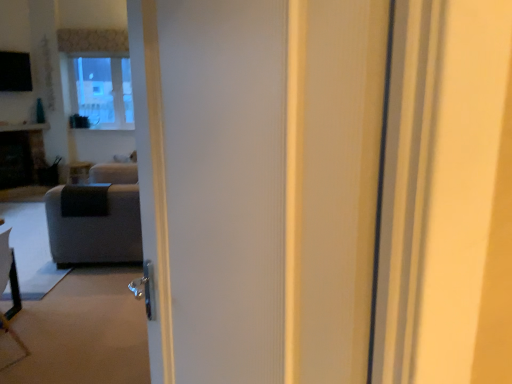
Question: From the image's perspective, is matte black side table at center beneath dark gray stone fireplace at left?

Choices:
 (A) no
 (B) yes

Answer: (B)

Question: Is matte black side table at center smaller than dark gray stone fireplace at left?

Choices:
 (A) yes
 (B) no

Answer: (A)

Question: Can you confirm if matte black side table at center is positioned to the right of dark gray stone fireplace at left?

Choices:
 (A) yes
 (B) no

Answer: (A)

Question: Is dark gray stone fireplace at left located within matte black side table at center?

Choices:
 (A) no
 (B) yes

Answer: (A)

Question: Is matte black side table at center positioned behind dark gray stone fireplace at left?

Choices:
 (A) no
 (B) yes

Answer: (B)

Question: From a real-world perspective, is matte black side table at center positioned over dark gray stone fireplace at left based on gravity?

Choices:
 (A) yes
 (B) no

Answer: (B)

Question: Considering the relative sizes of matte black side table at center and gray fabric couch at left in the image provided, is matte black side table at center thinner than gray fabric couch at left?

Choices:
 (A) no
 (B) yes

Answer: (B)

Question: Is matte black side table at center wider than gray fabric couch at left?

Choices:
 (A) no
 (B) yes

Answer: (A)

Question: Is matte black side table at center further to camera compared to gray fabric couch at left?

Choices:
 (A) no
 (B) yes

Answer: (B)

Question: Is matte black side table at center positioned far away from gray fabric couch at left?

Choices:
 (A) yes
 (B) no

Answer: (A)

Question: From a real-world perspective, is matte black side table at center located higher than gray fabric couch at left?

Choices:
 (A) yes
 (B) no

Answer: (B)

Question: Does matte black side table at center appear on the left side of gray fabric couch at left?

Choices:
 (A) yes
 (B) no

Answer: (A)

Question: Is gray fabric couch at left next to dark gray stone fireplace at left and touching it?

Choices:
 (A) no
 (B) yes

Answer: (A)